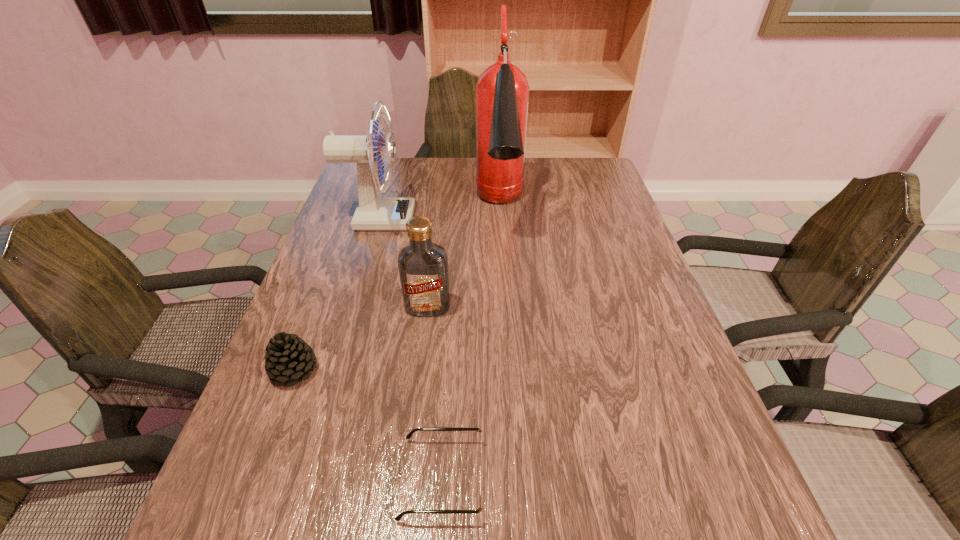
Identify the location of vacant area that satisfies the following two spatial constraints: 1. on the front-facing side of the third nearest object; 2. at the narrow end of the fourth tallest object. Image resolution: width=960 pixels, height=540 pixels. (420, 370).

At what (x,y) coordinates should I click in order to perform the action: click on free space that satisfies the following two spatial constraints: 1. on the front-facing side of the vodka; 2. at the narrow end of the pinecone. Please return your answer as a coordinate pair (x, y). Image resolution: width=960 pixels, height=540 pixels. Looking at the image, I should click on (420, 370).